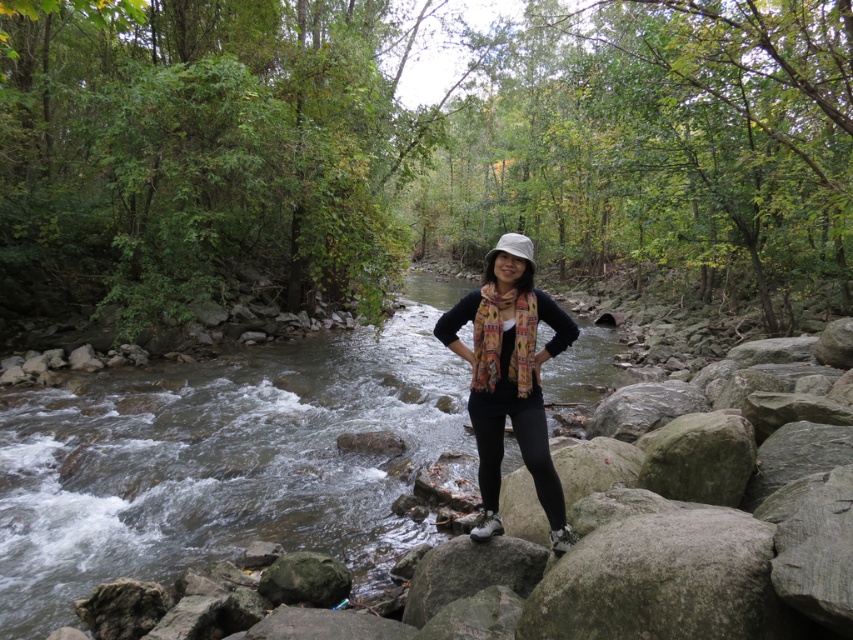
Question: Which point is closer to the camera taking this photo?

Choices:
 (A) (71, 602)
 (B) (477, 419)

Answer: (B)

Question: Where is clear water at stream center located in relation to black matte scarf at center in the image?

Choices:
 (A) above
 (B) below

Answer: (A)

Question: Which object is farther from the camera taking this photo?

Choices:
 (A) black matte scarf at center
 (B) clear water at stream center

Answer: (B)

Question: Is clear water at stream center in front of black matte scarf at center?

Choices:
 (A) yes
 (B) no

Answer: (B)

Question: Is clear water at stream center smaller than black matte scarf at center?

Choices:
 (A) yes
 (B) no

Answer: (B)